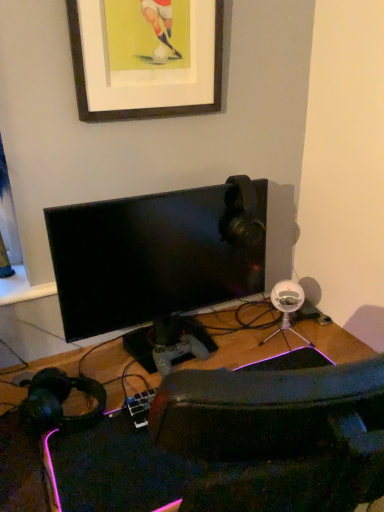
What do you see at coordinates (146, 57) in the screenshot? I see `wooden picture frame at upper center` at bounding box center [146, 57].

What do you see at coordinates (58, 401) in the screenshot? I see `black matte headphones at lower left` at bounding box center [58, 401].

Measure the distance between point (x=257, y=254) and camera.

A distance of 1.26 meters exists between point (x=257, y=254) and camera.

Locate an element on the screen. wooden picture frame at upper center is located at coordinates (146, 57).

Is point (211, 259) closer or farther from the camera than point (70, 20)?

Point (211, 259) is positioned farther from the camera compared to point (70, 20).

How different are the orientations of black glossy monitor at center and wooden picture frame at upper center in degrees?

0.00538 degrees separate the facing orientations of black glossy monitor at center and wooden picture frame at upper center.

Is black glossy monitor at center completely or partially outside of wooden picture frame at upper center?

black glossy monitor at center lies outside wooden picture frame at upper center's area.

From a real-world perspective, is black glossy monitor at center below wooden picture frame at upper center?

Correct, in the physical world, black glossy monitor at center is lower than wooden picture frame at upper center.

Could you tell me if wooden picture frame at upper center is turned towards black matte headphones at lower left?

No, wooden picture frame at upper center is not oriented towards black matte headphones at lower left.

Which point is more distant from viewer, [103,1] or [32,393]?

The point [32,393] is more distant.

Is wooden picture frame at upper center in front of or behind black matte headphones at lower left in the image?

wooden picture frame at upper center is positioned farther from the viewer than black matte headphones at lower left.

From the image's perspective, which is above, wooden picture frame at upper center or black matte headphones at lower left?

wooden picture frame at upper center is shown above in the image.

Could you tell me if wooden desk at center is turned towards wooden picture frame at upper center?

No, wooden desk at center is not turned towards wooden picture frame at upper center.

You are a GUI agent. You are given a task and a screenshot of the screen. Output one action in this format:
    pyautogui.click(x=<x>, y=<y>)
    Task: Click on the desk directly beneath the wooden picture frame at upper center (from a real-world perspective)
    The width and height of the screenshot is (384, 512).
    Given the screenshot: What is the action you would take?
    pyautogui.click(x=232, y=446)

Which object is closer to the camera, wooden desk at center or wooden picture frame at upper center?

Positioned in front is wooden desk at center.

Is wooden desk at center wider or thinner than wooden picture frame at upper center?

In the image, wooden desk at center appears to be wider than wooden picture frame at upper center.

Can you confirm if black matte headphones at lower left is positioned to the left of black glossy monitor at center?

Yes, black matte headphones at lower left is to the left of black glossy monitor at center.

In the scene shown: Is black matte headphones at lower left wider than black glossy monitor at center?

Indeed, black matte headphones at lower left has a greater width compared to black glossy monitor at center.

Which is behind, black matte headphones at lower left or black glossy monitor at center?

black glossy monitor at center is behind.

Looking at this image, how distant is black matte headphones at lower left from black glossy monitor at center?

The distance of black matte headphones at lower left from black glossy monitor at center is 13.94 inches.

Is black glossy monitor at center oriented away from wooden desk at center?

black glossy monitor at center does not have its back to wooden desk at center.

Which object is thinner, black glossy monitor at center or wooden desk at center?

Thinner between the two is black glossy monitor at center.

Does black glossy monitor at center touch wooden desk at center?

They are not placed beside each other.

From the picture: Is black glossy monitor at center not inside wooden desk at center?

Yes.

Can you tell me how much wooden desk at center and black glossy monitor at center differ in facing direction?

There is a 0.00599-degree angle between the facing directions of wooden desk at center and black glossy monitor at center.

Which is less distant, (20, 451) or (206, 236)?

Point (20, 451) is closer to the camera than point (206, 236).

From a real-world perspective, which object stands above the other?

Answer: black glossy monitor at center.

Is wooden desk at center bigger than black glossy monitor at center?

Incorrect, wooden desk at center is not larger than black glossy monitor at center.

Is black glossy monitor at center positioned far away from black matte headphones at lower left?

No, black glossy monitor at center is not far away from black matte headphones at lower left.

Considering the sizes of objects black glossy monitor at center and black matte headphones at lower left in the image provided, who is bigger, black glossy monitor at center or black matte headphones at lower left?

Bigger between the two is black glossy monitor at center.

Is black glossy monitor at center surrounding black matte headphones at lower left?

No, black glossy monitor at center does not contain black matte headphones at lower left.

Considering the positions of objects black glossy monitor at center and black matte headphones at lower left in the image provided, who is in front, black glossy monitor at center or black matte headphones at lower left?

black matte headphones at lower left is closer to the camera.

I want to click on picture frame on the left of the black glossy monitor at center, so click(x=146, y=57).

Locate an element on the screen. The height and width of the screenshot is (512, 384). picture frame above the black matte headphones at lower left (from a real-world perspective) is located at coordinates (146, 57).

Considering their positions, is black glossy monitor at center positioned further to wooden picture frame at upper center than wooden desk at center?

wooden desk at center is further to wooden picture frame at upper center.

Looking at the image, which one is located further to black glossy monitor at center, black matte headphones at lower left or wooden desk at center?

Among the two, wooden desk at center is located further to black glossy monitor at center.

When comparing their distances from wooden picture frame at upper center, does black matte headphones at lower left or black glossy monitor at center seem closer?

black glossy monitor at center is positioned closer to the anchor wooden picture frame at upper center.

From the image, which object appears to be farther from wooden picture frame at upper center, black matte headphones at lower left or wooden desk at center?

Based on the image, wooden desk at center appears to be further to wooden picture frame at upper center.

Considering their positions, is wooden desk at center positioned further to black glossy monitor at center than black matte headphones at lower left?

wooden desk at center lies further to black glossy monitor at center than the other object.

Based on the photo, from the image, which object appears to be farther from wooden desk at center, black glossy monitor at center or wooden picture frame at upper center?

Based on the image, wooden picture frame at upper center appears to be further to wooden desk at center.

Looking at the image, which one is located further to black matte headphones at lower left, black glossy monitor at center or wooden picture frame at upper center?

Based on the image, wooden picture frame at upper center appears to be further to black matte headphones at lower left.

Based on their spatial positions, is black matte headphones at lower left or black glossy monitor at center closer to wooden desk at center?

black matte headphones at lower left.

Where is `computer monitor between wooden picture frame at upper center and black matte headphones at lower left in the vertical direction`? The height and width of the screenshot is (512, 384). computer monitor between wooden picture frame at upper center and black matte headphones at lower left in the vertical direction is located at coordinates (157, 256).

Find the location of a particular element. The width and height of the screenshot is (384, 512). headphones that lies between black glossy monitor at center and wooden desk at center from top to bottom is located at coordinates (58, 401).

The height and width of the screenshot is (512, 384). I want to click on computer monitor between wooden picture frame at upper center and wooden desk at center from top to bottom, so click(157, 256).

What are the coordinates of `headphones that lies between wooden picture frame at upper center and wooden desk at center from top to bottom` in the screenshot? It's located at (58, 401).